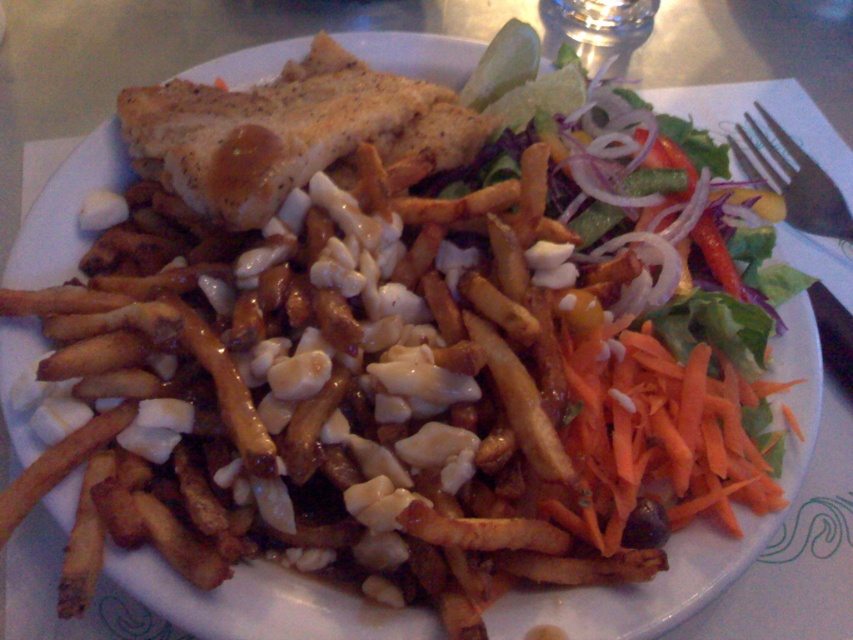
You are a food critic analyzing the arrangement of the dish. Which item is closer to the center of the plate between the orange shredded carrot at right and the black plastic fork at upper right?

The orange shredded carrot at right is closer to the center of the plate because it is positioned on the left side of the black plastic fork at upper right, placing it nearer to the central area.

You are a food critic analyzing the composition of the dish. Where is the orange shredded carrot at right positioned relative to the center of the plate?

The orange shredded carrot at right is located at point 0.672 on the x and 0.782 on the y axis, which places it to the right and slightly above the center of the plate.